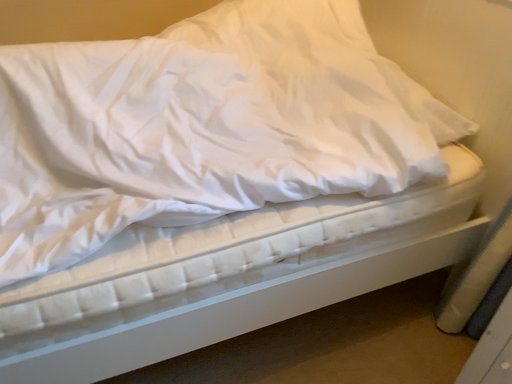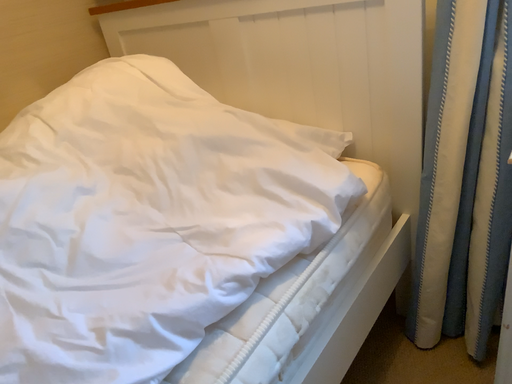
Question: How did the camera likely rotate when shooting the video?

Choices:
 (A) rotated downward
 (B) rotated upward

Answer: (B)